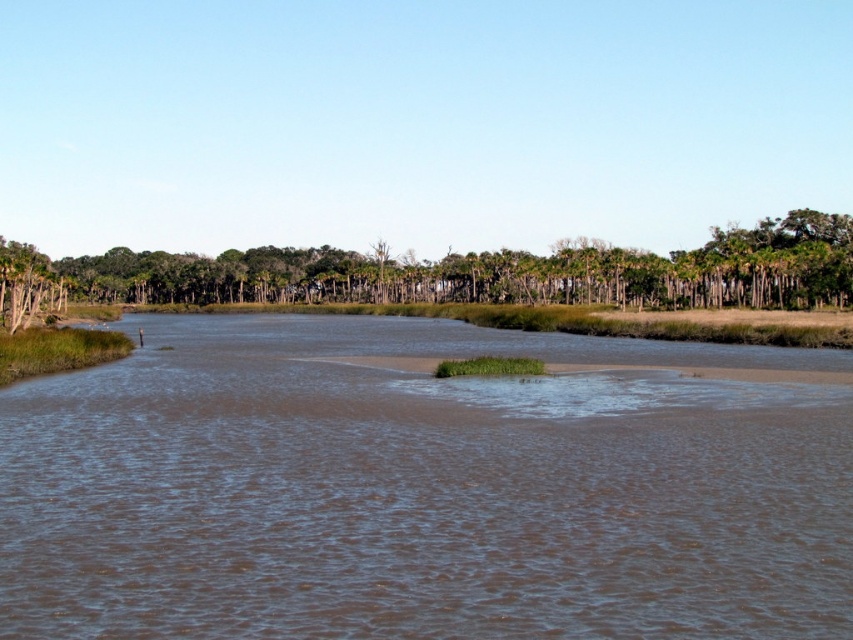
Based on the scene description, which object takes up more area in the image between the brown muddy water at center and the green leafy trees at center?

The green leafy trees at center occupy more space than the brown muddy water at center in the image.

You are standing at the edge of the marsh and want to cross to the other side. There is a narrow strip of land separating two larger bodies of water. Which direction should you head to avoid the brown muddy water at center?

You should head away from the brown muddy water at center, which is located at point (421, 490), to avoid it and find the narrow strip of land for crossing.

You are standing on a path near the brown muddy water at center and the green leafy trees at center. Which object is located below the other?

The brown muddy water at center is positioned under green leafy trees at center, so the water is below the trees.